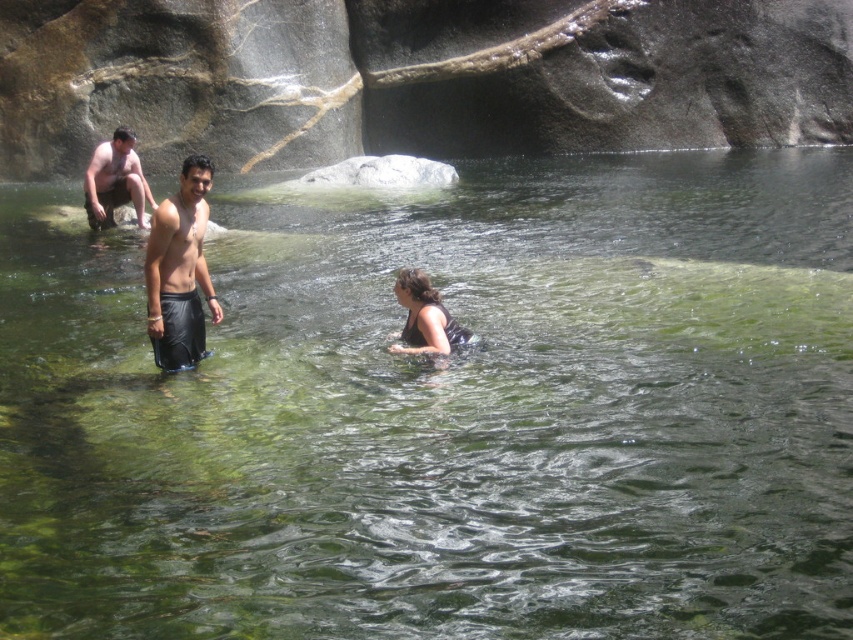
Does matte skin man at upper left appear over black matte swimsuit at center?

Correct, matte skin man at upper left is located above black matte swimsuit at center.

The height and width of the screenshot is (640, 853). Identify the location of matte skin man at upper left. pos(115,180).

The height and width of the screenshot is (640, 853). Find the location of `matte skin man at upper left`. matte skin man at upper left is located at coordinates (115, 180).

Can you confirm if black matte shorts at center is wider than black matte swimsuit at center?

No.

What do you see at coordinates (178, 272) in the screenshot?
I see `black matte shorts at center` at bounding box center [178, 272].

Measure the distance between point (178, 273) and camera.

Point (178, 273) and camera are 33.52 feet apart from each other.

This screenshot has width=853, height=640. In order to click on black matte shorts at center in this screenshot , I will do `click(178, 272)`.

Is black matte shorts at center smaller than matte skin man at upper left?

Actually, black matte shorts at center might be larger than matte skin man at upper left.

Can you confirm if black matte shorts at center is positioned below matte skin man at upper left?

Indeed, black matte shorts at center is positioned under matte skin man at upper left.

Is point (189, 301) positioned behind point (91, 220)?

No, (189, 301) is closer to viewer.

This screenshot has width=853, height=640. What are the coordinates of `black matte shorts at center` in the screenshot? It's located at (178, 272).